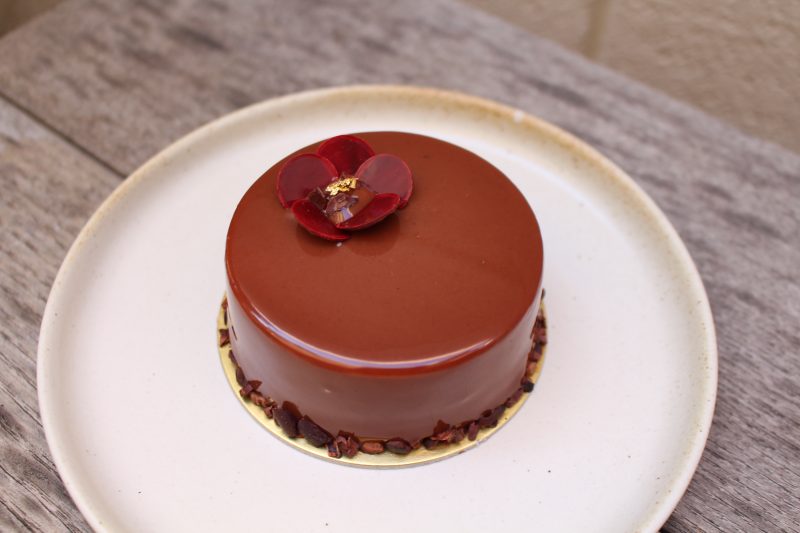
What are the coordinates of `flower decoration` in the screenshot? It's located at (352, 196).